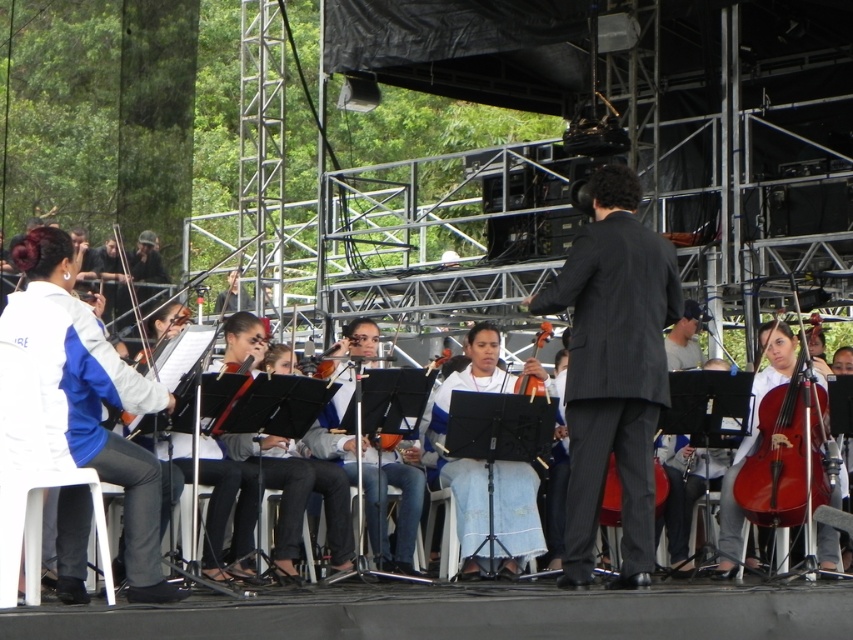
You are a photographer at the event and want to capture a photo that includes both the shiny red wood cello at right and the matte orange violin at center. From which side of the violin should you position yourself to ensure both instruments are in frame?

To include both the shiny red wood cello at right and the matte orange violin at center in the photo, you should position yourself to the right of the matte orange violin at center. Since the shiny red wood cello at right is located to the right of the violin, this positioning allows both instruments to be captured within the frame.